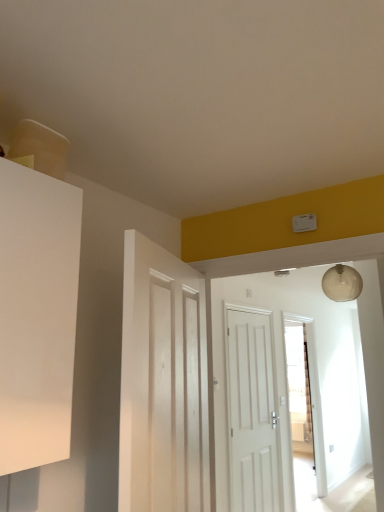
This screenshot has height=512, width=384. What do you see at coordinates (252, 411) in the screenshot?
I see `white matte door at center, the first door when ordered from right to left` at bounding box center [252, 411].

You are a GUI agent. You are given a task and a screenshot of the screen. Output one action in this format:
    pyautogui.click(x=<x>, y=<y>)
    Task: Click on the transparent glass door at center
    
    Given the screenshot: What is the action you would take?
    pyautogui.click(x=313, y=399)

Is white matte door at center, which is counted as the 2th door, starting from the left, located outside transparent glass door at center?

Yes, white matte door at center, which is counted as the 2th door, starting from the left, is not within transparent glass door at center.

Does white matte door at center, the 2th door positioned from the front, have a greater width compared to transparent glass door at center?

In fact, white matte door at center, the 2th door positioned from the front, might be narrower than transparent glass door at center.

Is white matte door at center, which ranks as the 1th door in back-to-front order, in front of or behind transparent glass door at center in the image?

Visually, white matte door at center, which ranks as the 1th door in back-to-front order, is located in front of transparent glass door at center.

Who is shorter, white matte door at center, the first door when ordered from right to left, or transparent glass door at center?

With less height is white matte door at center, the first door when ordered from right to left.

How distant is white matte door at center, the 2th door positioned from the front, from white wooden door at center, which is counted as the second door, starting from the right?

A distance of 6.94 feet exists between white matte door at center, the 2th door positioned from the front, and white wooden door at center, which is counted as the second door, starting from the right.

Who is shorter, white matte door at center, which is counted as the 2th door, starting from the left, or white wooden door at center, which ranks as the 1th door in front-to-back order?

→ With less height is white wooden door at center, which ranks as the 1th door in front-to-back order.

Is white matte door at center, the 2th door positioned from the front, aimed at white wooden door at center, which ranks as the 1th door in front-to-back order?

No, white matte door at center, the 2th door positioned from the front, is not turned towards white wooden door at center, which ranks as the 1th door in front-to-back order.

Is white matte door at center, the 2th door positioned from the front, next to white wooden door at center, which ranks as the 1th door in front-to-back order?

No, white matte door at center, the 2th door positioned from the front, is not in contact with white wooden door at center, which ranks as the 1th door in front-to-back order.

Looking at this image, is transparent glass door at center completely or partially inside white wooden door at center, which ranks as the 1th door in front-to-back order?

No.

Between white wooden door at center, which ranks as the 1th door in front-to-back order, and transparent glass door at center, which one has larger size?

transparent glass door at center.

Between point (130, 475) and point (300, 320), which one is positioned in front?

Point (130, 475)

In the scene shown: Can you tell me how much white wooden door at center, which is counted as the second door, starting from the right, and transparent glass door at center differ in facing direction?

The facing directions of white wooden door at center, which is counted as the second door, starting from the right, and transparent glass door at center are 20 degrees apart.

Is the surface of white wooden door at center, the second door in the back-to-front sequence, in direct contact with white matte door at center, the 2th door positioned from the front?

No, white wooden door at center, the second door in the back-to-front sequence, is not next to white matte door at center, the 2th door positioned from the front.

Is white wooden door at center, which is counted as the second door, starting from the right, not within white matte door at center, which is counted as the 2th door, starting from the left?

→ white wooden door at center, which is counted as the second door, starting from the right, is positioned outside white matte door at center, which is counted as the 2th door, starting from the left.

Considering the relative sizes of white wooden door at center, the second door in the back-to-front sequence, and white matte door at center, the first door when ordered from right to left, in the image provided, is white wooden door at center, the second door in the back-to-front sequence, taller than white matte door at center, the first door when ordered from right to left,?

In fact, white wooden door at center, the second door in the back-to-front sequence, may be shorter than white matte door at center, the first door when ordered from right to left.

Can you tell me how much white wooden door at center, which is counted as the second door, starting from the right, and white matte door at center, the 2th door positioned from the front, differ in facing direction?

There is a 20-degree angle between the facing directions of white wooden door at center, which is counted as the second door, starting from the right, and white matte door at center, the 2th door positioned from the front.

The image size is (384, 512). I want to click on glass door behind the white matte door at center, the first door when ordered from right to left, so click(313, 399).

From the image's perspective, would you say transparent glass door at center is positioned over white matte door at center, the 2th door positioned from the front?

No.

Is transparent glass door at center looking in the opposite direction of white matte door at center, which is counted as the 2th door, starting from the left?

That's not correct — transparent glass door at center is not looking away from white matte door at center, which is counted as the 2th door, starting from the left.

Is transparent glass door at center in front of or behind white wooden door at center, marked as the first door in a left-to-right arrangement, in the image?

transparent glass door at center is behind white wooden door at center, marked as the first door in a left-to-right arrangement.

From the image's perspective, is transparent glass door at center beneath white wooden door at center, which ranks as the 1th door in front-to-back order?

Yes.

What's the angular difference between transparent glass door at center and white wooden door at center, marked as the first door in a left-to-right arrangement,'s facing directions?

20 degrees separate the facing orientations of transparent glass door at center and white wooden door at center, marked as the first door in a left-to-right arrangement.

Does transparent glass door at center have a larger size compared to white wooden door at center, which ranks as the 1th door in front-to-back order?

Yes.

This screenshot has width=384, height=512. I want to click on the 1st door in front of the transparent glass door at center, so click(252, 411).

You are a GUI agent. You are given a task and a screenshot of the screen. Output one action in this format:
    pyautogui.click(x=<x>, y=<y>)
    Task: Click on the door below the white wooden door at center, which is counted as the second door, starting from the right (from the image's perspective)
    This screenshot has width=384, height=512.
    Given the screenshot: What is the action you would take?
    pyautogui.click(x=252, y=411)

Estimate the real-world distances between objects in this image. Which object is further from transparent glass door at center, white matte door at center, the first door when ordered from right to left, or white wooden door at center, marked as the first door in a left-to-right arrangement?

white wooden door at center, marked as the first door in a left-to-right arrangement, is further to transparent glass door at center.

Which object lies further to the anchor point white matte door at center, the 2th door positioned from the front, transparent glass door at center or white wooden door at center, which is counted as the second door, starting from the right?

white wooden door at center, which is counted as the second door, starting from the right.

Based on their spatial positions, is white wooden door at center, marked as the first door in a left-to-right arrangement, or white matte door at center, which is counted as the 2th door, starting from the left, further from transparent glass door at center?

Based on the image, white wooden door at center, marked as the first door in a left-to-right arrangement, appears to be further to transparent glass door at center.

Estimate the real-world distances between objects in this image. Which object is closer to white wooden door at center, which ranks as the 1th door in front-to-back order, white matte door at center, the 2th door positioned from the front, or transparent glass door at center?

Among the two, white matte door at center, the 2th door positioned from the front, is located nearer to white wooden door at center, which ranks as the 1th door in front-to-back order.

Estimate the real-world distances between objects in this image. Which object is closer to white matte door at center, the first door when ordered from right to left, white wooden door at center, the second door in the back-to-front sequence, or transparent glass door at center?

The object closer to white matte door at center, the first door when ordered from right to left, is transparent glass door at center.

When comparing their distances from white wooden door at center, the second door in the back-to-front sequence, does transparent glass door at center or white matte door at center, which ranks as the 1th door in back-to-front order, seem further?

transparent glass door at center is further to white wooden door at center, the second door in the back-to-front sequence.

Locate an element on the screen. door located between white wooden door at center, the second door in the back-to-front sequence, and transparent glass door at center in the depth direction is located at coordinates (252, 411).